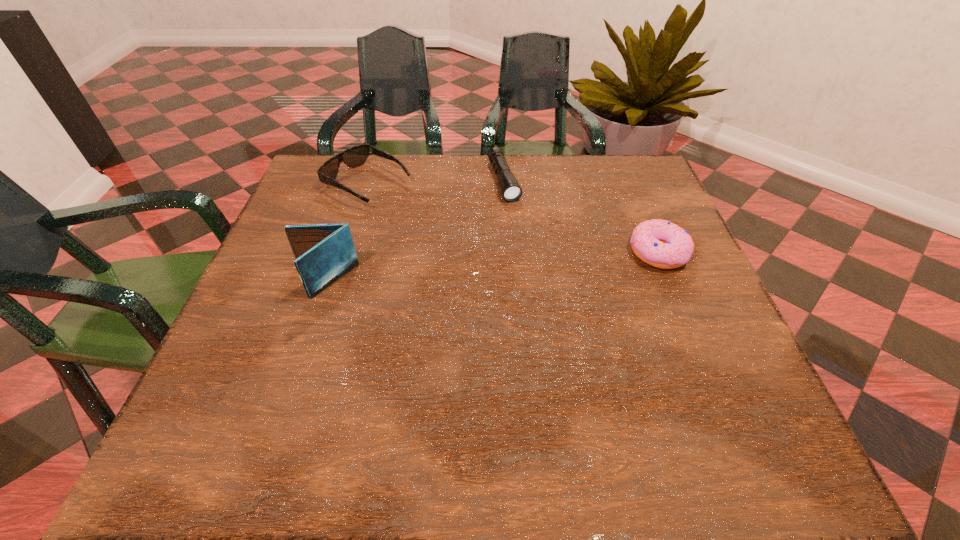
The image size is (960, 540). What are the coordinates of `wallet` in the screenshot? It's located at (324, 253).

This screenshot has height=540, width=960. Identify the location of the rightmost object. (662, 244).

The image size is (960, 540). I want to click on sunglasses, so click(353, 157).

The height and width of the screenshot is (540, 960). What are the coordinates of `flashlight` in the screenshot? It's located at (511, 191).

Find the location of a particular element. the third object from left to right is located at coordinates (511, 191).

This screenshot has height=540, width=960. In order to click on blank area located 0.290m on the back of the doughnut in this screenshot , I will do `click(622, 165)`.

At what (x,y) coordinates should I click in order to perform the action: click on vacant space situated 0.170m on the front-facing side of the sunglasses. Please return your answer as a coordinate pair (x, y). The width and height of the screenshot is (960, 540). Looking at the image, I should click on (451, 226).

This screenshot has height=540, width=960. What are the coordinates of `vacant space situated on the front-facing side of the sunglasses` in the screenshot? It's located at (425, 214).

The width and height of the screenshot is (960, 540). Identify the location of vacant space located 0.230m on the front-facing side of the sunglasses. (471, 237).

Identify the location of vacant space located 0.320m at the lens end of the flashlight. This screenshot has height=540, width=960. (548, 296).